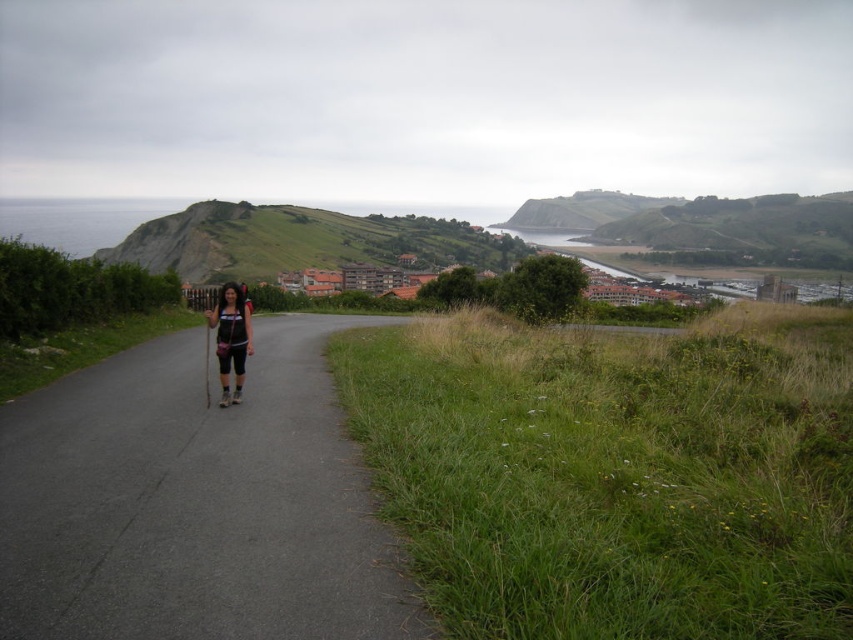
You are a hiker trying to reach a destination located at the same position as the matte black shorts at center. The green grassy hillside at center is an obstacle. Can you walk around it by moving to the right side of the path?

The green grassy hillside at center is 123.81 meters away from matte black shorts at center. Since the path is bordered by taller grasses and shrubs on the right side, moving to the right might not be feasible due to the vegetation. However, the left side has a low hedge or fence, which might allow passage. Therefore, it would be better to go around to the left side of the path instead of the right.

You are standing at the starting point of your hike and see the asphalt road at center. Based on its position, can you determine if it is closer to the left or right side of the path?

The asphalt road at center is located at point 0.786 on the x axis and 0.230 on the y axis. Since the x coordinate is closer to 1, it is positioned more to the right side of the path.